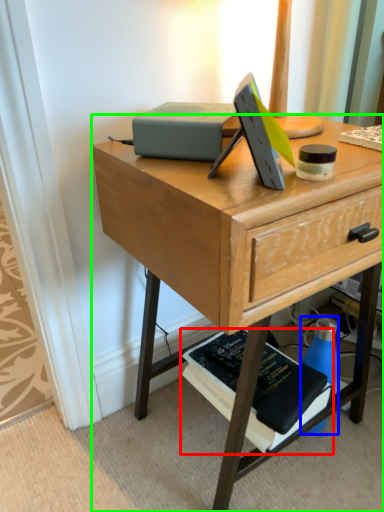
Question: Based on their relative distances, which object is farther from paperback book (highlighted by a red box)? Choose from bottle (highlighted by a blue box) and desk (highlighted by a green box).

Choices:
 (A) bottle
 (B) desk

Answer: (B)